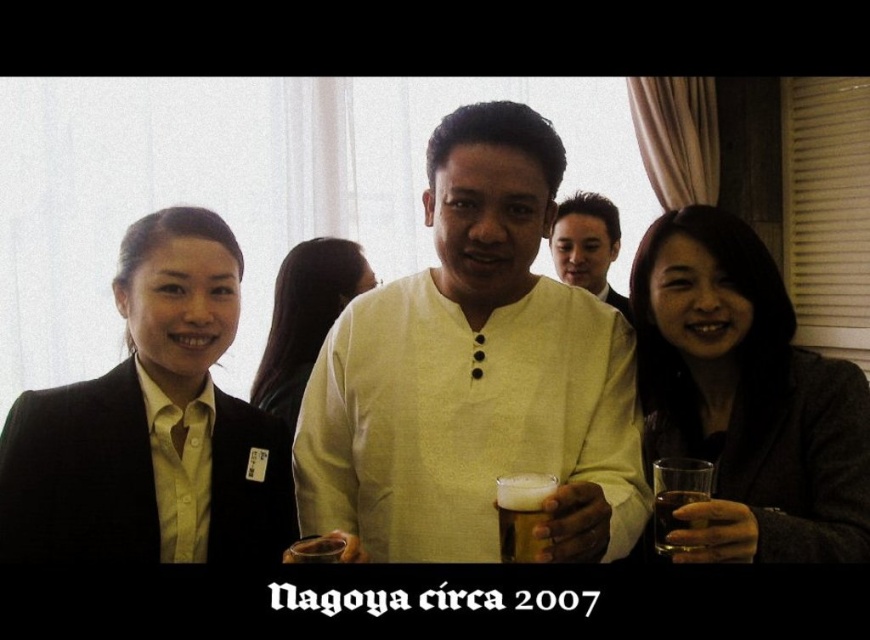
Question: Is matte gray blazer at right bigger than translucent glass at right?

Choices:
 (A) yes
 (B) no

Answer: (A)

Question: Is matte black blazer at center to the left of foamy golden beer at center from the viewer's perspective?

Choices:
 (A) yes
 (B) no

Answer: (B)

Question: Can you confirm if light yellow cotton shirt at center is wider than matte black blazer at left?

Choices:
 (A) no
 (B) yes

Answer: (B)

Question: Which of the following is the closest to the observer?

Choices:
 (A) foamy golden beer at center
 (B) golden amber liquid at center

Answer: (B)

Question: Which object appears farthest from the camera in this image?

Choices:
 (A) translucent glass at right
 (B) matte black blazer at left
 (C) matte black blazer at center

Answer: (C)

Question: Among these objects, which one is nearest to the camera?

Choices:
 (A) golden amber liquid at center
 (B) matte yellow shirt at center

Answer: (A)